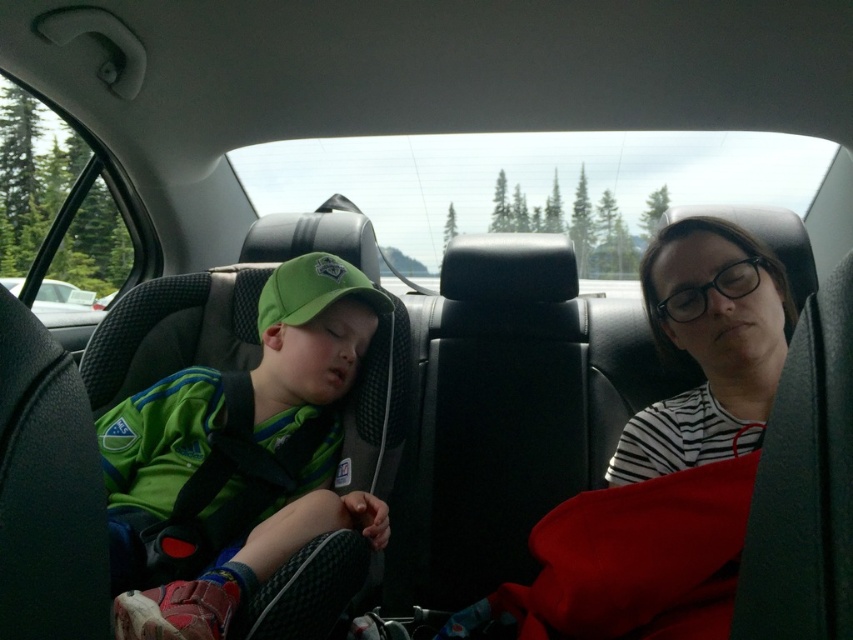
Is white striped shirt at upper right to the left of white glossy car at left from the viewer's perspective?

Incorrect, white striped shirt at upper right is not on the left side of white glossy car at left.

Is white striped shirt at upper right to the right of white glossy car at left from the viewer's perspective?

Indeed, white striped shirt at upper right is positioned on the right side of white glossy car at left.

Is point (701, 339) in front of point (9, 284)?

That is True.

Image resolution: width=853 pixels, height=640 pixels. I want to click on white striped shirt at upper right, so click(708, 346).

Which of these two, green matte baseball cap at left or white striped shirt at upper right, stands taller?

green matte baseball cap at left

Can you confirm if green matte baseball cap at left is positioned to the left of white striped shirt at upper right?

Correct, you'll find green matte baseball cap at left to the left of white striped shirt at upper right.

Who is more forward, [306,380] or [660,440]?

Point [660,440] is in front.

Find the location of a particular element. The width and height of the screenshot is (853, 640). green matte baseball cap at left is located at coordinates (238, 460).

Is green matte baseball cap at left positioned at the back of white glossy car at left?

No, green matte baseball cap at left is in front of white glossy car at left.

Is point (134, 442) closer to camera compared to point (42, 285)?

Yes, point (134, 442) is closer to viewer.

Find the location of a particular element. The image size is (853, 640). green matte baseball cap at left is located at coordinates (238, 460).